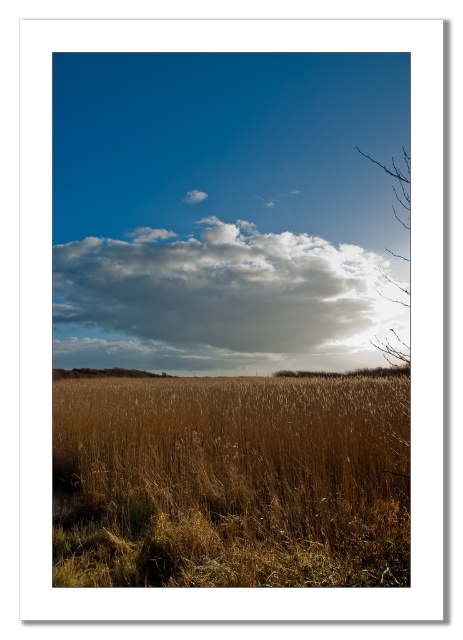
Question: Is cloudy white cloud at upper center above brown textured tree at lower right?

Choices:
 (A) no
 (B) yes

Answer: (B)

Question: Which object appears farthest from the camera in this image?

Choices:
 (A) cloudy white cloud at upper center
 (B) brown grassy field at center
 (C) bare branches at upper right
 (D) brown textured tree at lower right

Answer: (D)

Question: Estimate the real-world distances between objects in this image. Which object is farther from the cloudy white cloud at upper center?

Choices:
 (A) brown grassy field at center
 (B) brown textured tree at lower right
 (C) bare branches at upper right

Answer: (A)

Question: Is brown grassy field at center wider than brown textured tree at lower right?

Choices:
 (A) no
 (B) yes

Answer: (B)

Question: Is brown grassy field at center further to camera compared to bare branches at upper right?

Choices:
 (A) yes
 (B) no

Answer: (B)

Question: Estimate the real-world distances between objects in this image. Which object is farther from the cloudy white cloud at upper center?

Choices:
 (A) brown grassy field at center
 (B) brown textured tree at lower right

Answer: (A)